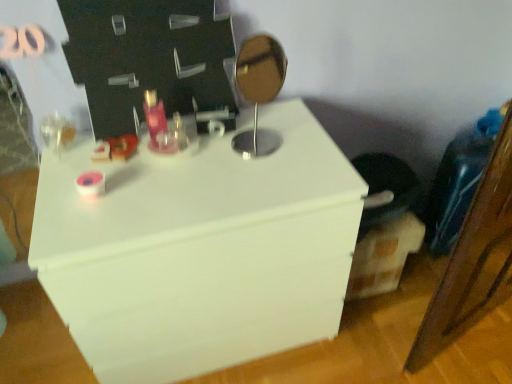
The height and width of the screenshot is (384, 512). Describe the element at coordinates (260, 73) in the screenshot. I see `metallic silver mirror at center` at that location.

What do you see at coordinates (199, 250) in the screenshot? The height and width of the screenshot is (384, 512). I see `white matte dresser at center` at bounding box center [199, 250].

This screenshot has width=512, height=384. In order to click on metallic silver mirror at center in this screenshot , I will do `click(260, 73)`.

From the picture: From a real-world perspective, which is physically below, white matte dresser at center or metallic silver mirror at center?

white matte dresser at center, from a real-world perspective.

Based on the photo, what's the angular difference between white matte dresser at center and metallic silver mirror at center's facing directions?

There is a 22.5-degree angle between the facing directions of white matte dresser at center and metallic silver mirror at center.

At what (x,y) coordinates should I click in order to perform the action: click on table lamp to the right of white matte dresser at center. Please return your answer as a coordinate pair (x, y). Looking at the image, I should click on (260, 73).

Is white matte dresser at center thinner than metallic silver mirror at center?

No.

Considering the sizes of objects metallic silver mirror at center and white matte dresser at center in the image provided, who is bigger, metallic silver mirror at center or white matte dresser at center?

Bigger between the two is white matte dresser at center.

Does point (256, 127) come in front of point (130, 225)?

No, it is behind (130, 225).

Between metallic silver mirror at center and white matte dresser at center, which one appears on the right side from the viewer's perspective?

Positioned to the right is metallic silver mirror at center.

Between metallic silver mirror at center and white matte dresser at center, which one has larger width?

white matte dresser at center.

In the image, is matte pink glass at center on the left side or the right side of metallic silver mirror at center?

In the image, matte pink glass at center appears on the left side of metallic silver mirror at center.

Is point (160, 109) in front of point (272, 60)?

Yes, it is.

Is matte pink glass at center facing away from metallic silver mirror at center?

No, matte pink glass at center's orientation is not away from metallic silver mirror at center.

Consider the image. Is matte pink glass at center beside metallic silver mirror at center?

There is a gap between matte pink glass at center and metallic silver mirror at center.

Is matte pink glass at center looking in the opposite direction of white matte dresser at center?

No, matte pink glass at center's orientation is not away from white matte dresser at center.

Is matte pink glass at center positioned far away from white matte dresser at center?

No, matte pink glass at center is not far away from white matte dresser at center.

Can you tell me how much matte pink glass at center and white matte dresser at center differ in facing direction?

They differ by 0.947 degrees in their facing directions.

In terms of height, does white matte dresser at center look taller or shorter compared to matte pink glass at center?

Considering their sizes, white matte dresser at center has more height than matte pink glass at center.

In the scene shown: Is white matte dresser at center not within matte pink glass at center?

Indeed, white matte dresser at center is completely outside matte pink glass at center.

Does point (42, 243) come behind point (155, 90)?

No.

Is white matte dresser at center facing towards matte pink glass at center?

No, white matte dresser at center is not facing towards matte pink glass at center.

Does metallic silver mirror at center have a larger size compared to matte pink glass at center?

Yes, metallic silver mirror at center is bigger than matte pink glass at center.

In the scene shown: Is metallic silver mirror at center inside or outside of matte pink glass at center?

metallic silver mirror at center is not enclosed by matte pink glass at center.

Is metallic silver mirror at center aimed at matte pink glass at center?

No, metallic silver mirror at center is not turned towards matte pink glass at center.

Is metallic silver mirror at center taller or shorter than matte pink glass at center?

Considering their sizes, metallic silver mirror at center has more height than matte pink glass at center.

You are a GUI agent. You are given a task and a screenshot of the screen. Output one action in this format:
    pyautogui.click(x=<x>, y=<y>)
    Task: Click on the table lamp above the white matte dresser at center (from a real-world perspective)
    The width and height of the screenshot is (512, 384).
    Given the screenshot: What is the action you would take?
    pyautogui.click(x=260, y=73)

You are a GUI agent. You are given a task and a screenshot of the screen. Output one action in this format:
    pyautogui.click(x=<x>, y=<y>)
    Task: Click on the furniture lying on the left of metallic silver mirror at center
    
    Given the screenshot: What is the action you would take?
    199,250

From the image, which object appears to be farther from white matte dresser at center, metallic silver mirror at center or matte pink glass at center?

Based on the image, matte pink glass at center appears to be further to white matte dresser at center.

Estimate the real-world distances between objects in this image. Which object is closer to metallic silver mirror at center, white matte dresser at center or matte pink glass at center?

matte pink glass at center.

Based on their spatial positions, is white matte dresser at center or metallic silver mirror at center closer to matte pink glass at center?

metallic silver mirror at center is positioned closer to the anchor matte pink glass at center.

Looking at the image, which one is located closer to white matte dresser at center, matte pink glass at center or metallic silver mirror at center?

metallic silver mirror at center is positioned closer to the anchor white matte dresser at center.

Estimate the real-world distances between objects in this image. Which object is further from matte pink glass at center, metallic silver mirror at center or white matte dresser at center?

white matte dresser at center lies further to matte pink glass at center than the other object.

Based on their spatial positions, is matte pink glass at center or white matte dresser at center further from metallic silver mirror at center?

Among the two, white matte dresser at center is located further to metallic silver mirror at center.

Where is `toiletry between metallic silver mirror at center and white matte dresser at center from top to bottom`? This screenshot has width=512, height=384. toiletry between metallic silver mirror at center and white matte dresser at center from top to bottom is located at coordinates (154, 115).